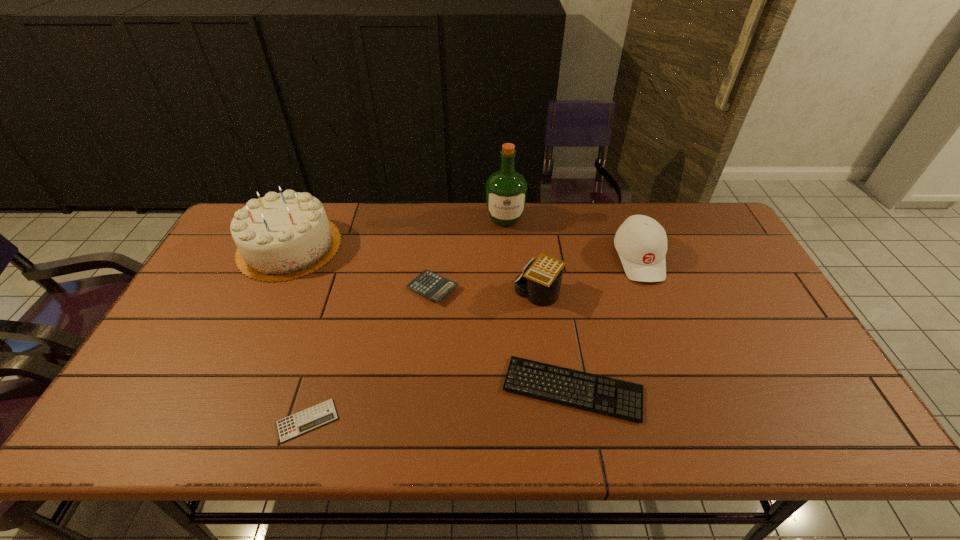
Find the location of a particular element. This screenshot has height=540, width=960. vacant point located 0.380m on the right of the sixth shortest object is located at coordinates (458, 246).

I want to click on vacant area located on the front-facing side of the baseball cap, so click(659, 310).

This screenshot has height=540, width=960. Find the location of `free space located 0.210m on the back of the tallest calculator`. free space located 0.210m on the back of the tallest calculator is located at coordinates (531, 233).

Locate an element on the screen. This screenshot has height=540, width=960. free space located on the back of the second tallest calculator is located at coordinates (437, 249).

Image resolution: width=960 pixels, height=540 pixels. Identify the location of free spot located 0.360m on the right of the second shortest object. (793, 389).

What are the coordinates of `free region located on the back of the shortest object` in the screenshot? It's located at (327, 354).

Find the location of `liquor that is at the far edge`. liquor that is at the far edge is located at coordinates (506, 190).

Image resolution: width=960 pixels, height=540 pixels. What are the coordinates of `birthday cake that is positioned at the far edge` in the screenshot? It's located at pos(282,236).

What are the coordinates of `baseball cap at the far edge` in the screenshot? It's located at (641, 242).

Identify the location of computer keyboard at the near edge. The image size is (960, 540). (618, 398).